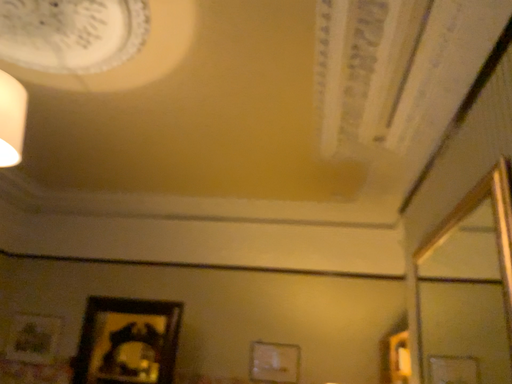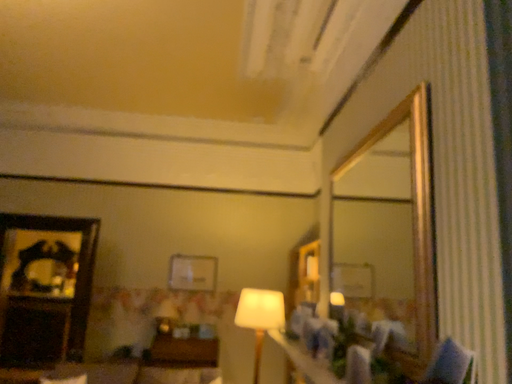
Question: Which way did the camera rotate in the video?

Choices:
 (A) rotated upward
 (B) rotated downward

Answer: (B)